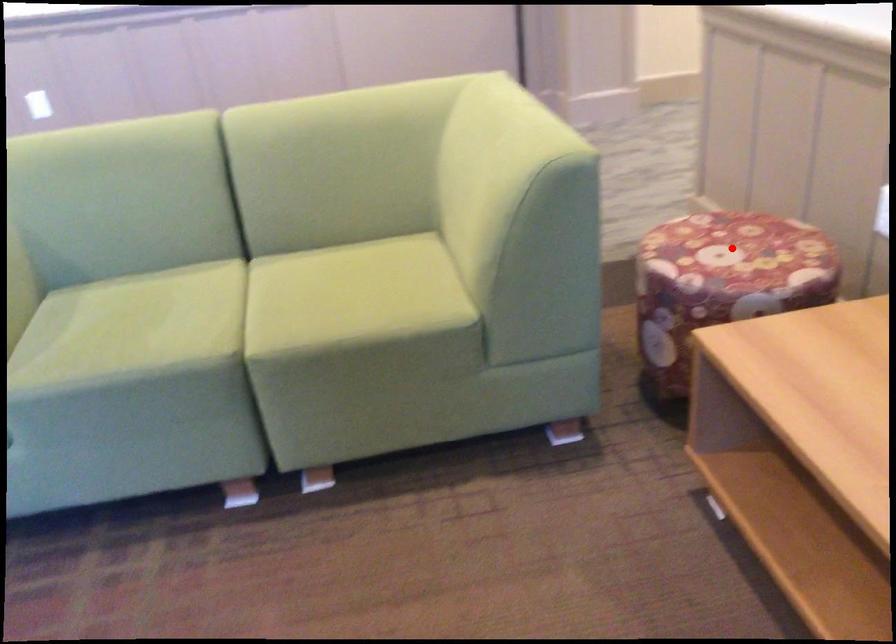
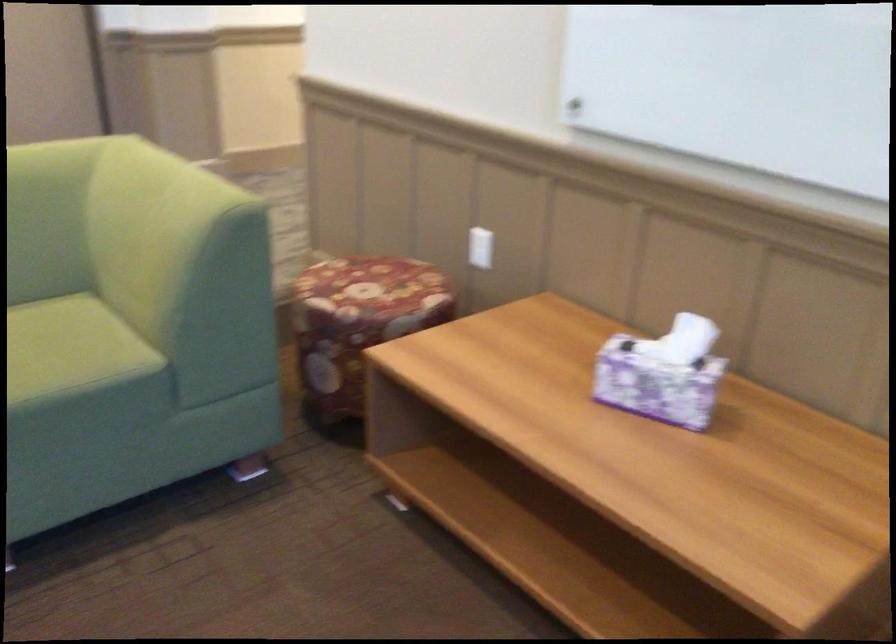
Question: I am providing you with two images of the same scene from different viewpoints. Image1 has a red point marked. In image2, the corresponding 3D location appears at what relative position? Reply with the corresponding letter.

Choices:
 (A) Closer
 (B) Farther

Answer: (B)